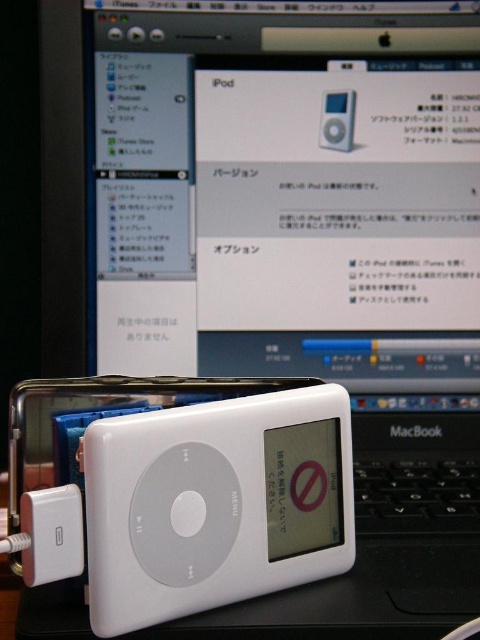
You are trying to determine which iPod is better suited for a gift. Both the white glossy iPod at center and the white plastic iPod at center are available. Considering their physical dimensions, which one is taller?

The white glossy iPod at center is taller than the white plastic iPod at center, so it would be the better choice if you prefer a taller design.

What are the coordinates of the white glossy iPod at center in the image?

The white glossy iPod at center is located at coordinates point (216, 502).

You are organizing a tech repair event and need to place both the white plastic ipod at lower left and the white plastic ipod at center into a storage box. The box has a width limit of 12 centimeters. Based on their sizes, which ipod might not fit if placed individually?

The white plastic ipod at lower left has a greater width than the white plastic ipod at center, so the white plastic ipod at lower left might not fit into the storage box if placed individually.